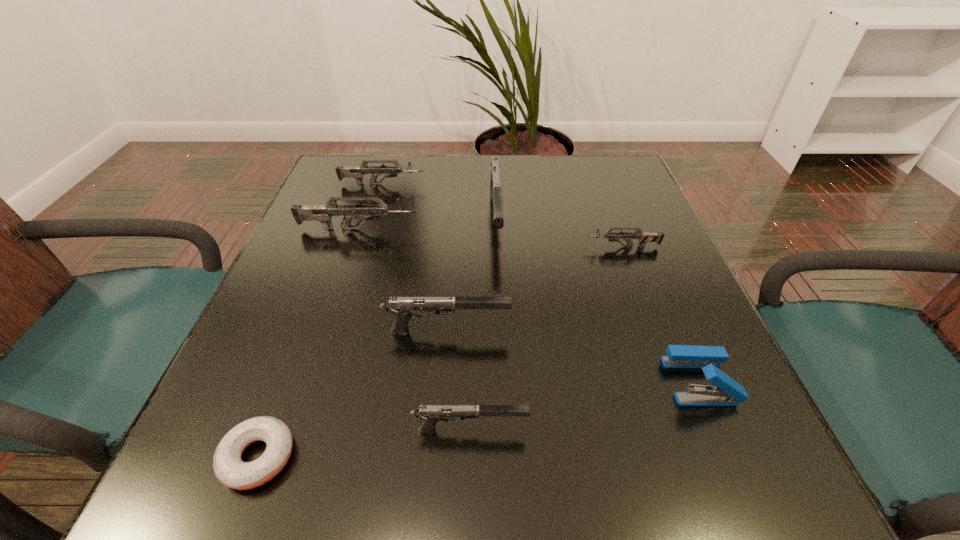
Locate an element on the screen. This screenshot has width=960, height=540. the nearest gray gun is located at coordinates (429, 414).

Where is `the rightmost grey gun`? the rightmost grey gun is located at coordinates (644, 237).

Find the location of a particular element. This screenshot has height=540, width=960. the rightmost gun is located at coordinates (644, 237).

Identify the location of the shortest object. (230, 470).

Locate an element on the screen. This screenshot has height=540, width=960. vacant region located 0.280m at the muzzle end of the tallest object is located at coordinates (503, 370).

Locate an element on the screen. free region located aimed along the barrel of the second farthest grey gun is located at coordinates (446, 229).

The width and height of the screenshot is (960, 540). Identify the location of free location located 0.210m at the muzzle end of the second farthest gray gun. (630, 330).

Locate an element on the screen. This screenshot has height=540, width=960. free space located on the back of the sixth farthest object is located at coordinates (674, 321).

Where is `free space located 0.350m aimed along the barrel of the second smallest grey gun`? The width and height of the screenshot is (960, 540). free space located 0.350m aimed along the barrel of the second smallest grey gun is located at coordinates (562, 184).

Where is `free spot located at the muzzle end of the nearest gun`? This screenshot has height=540, width=960. free spot located at the muzzle end of the nearest gun is located at coordinates (624, 429).